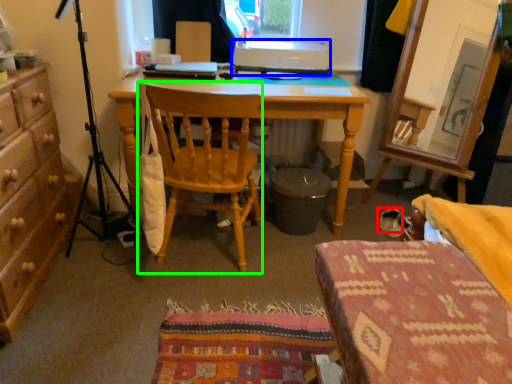
Question: Which is nearer to the footwear (highlighted by a red box)? printer (highlighted by a blue box) or chair (highlighted by a green box).

Choices:
 (A) printer
 (B) chair

Answer: (B)